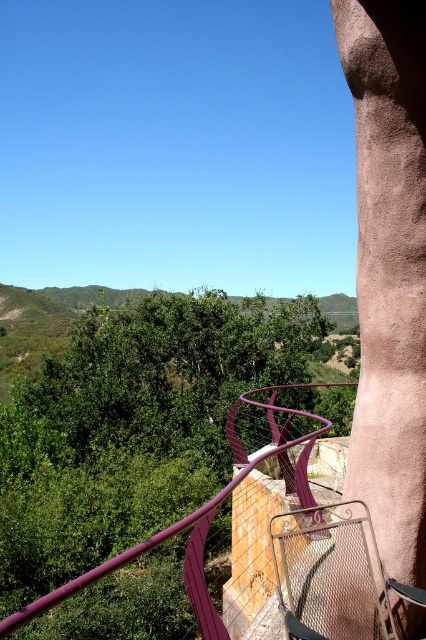
Question: Can you confirm if green leafy tree at center is positioned below purple metallic railing at upper right?

Choices:
 (A) no
 (B) yes

Answer: (B)

Question: Observing the image, what is the correct spatial positioning of green leafy tree at center in reference to purple metallic railing at upper right?

Choices:
 (A) below
 (B) above

Answer: (A)

Question: Is the position of green leafy tree at center more distant than that of purple metallic railing at upper right?

Choices:
 (A) yes
 (B) no

Answer: (A)